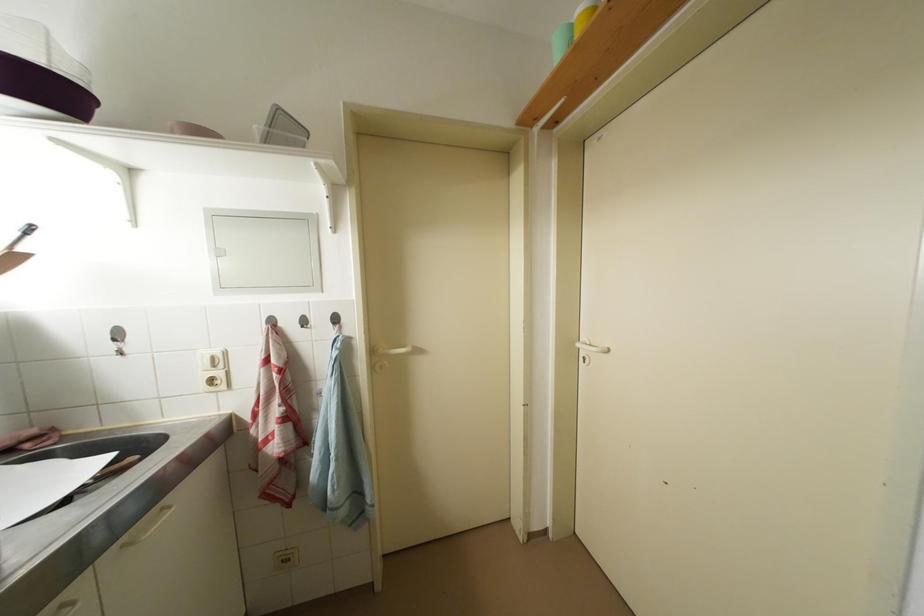
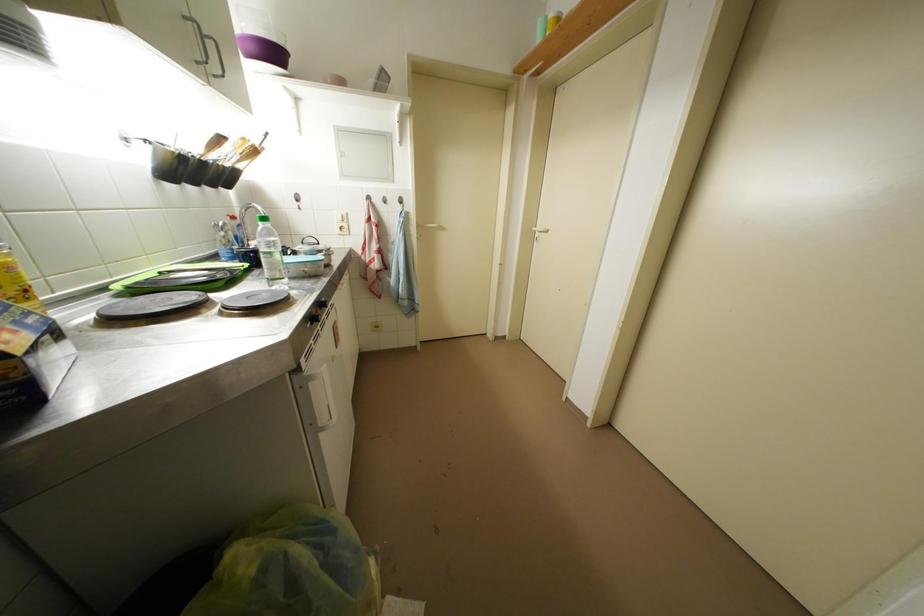
Question: The images are taken continuously from a first-person perspective. In which direction is your viewpoint rotating?

Choices:
 (A) Left
 (B) Right
 (C) Up
 (D) Down

Answer: (D)